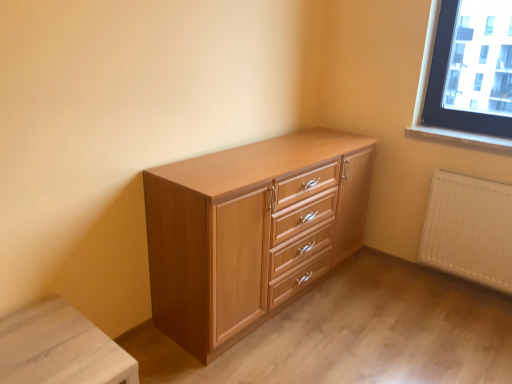
Question: Is smooth wood window sill at upper right next to light brown wood chest of drawers at center and touching it?

Choices:
 (A) no
 (B) yes

Answer: (A)

Question: From a real-world perspective, is smooth wood window sill at upper right physically below light brown wood chest of drawers at center?

Choices:
 (A) no
 (B) yes

Answer: (A)

Question: Considering the relative positions of smooth wood window sill at upper right and light brown wood chest of drawers at center in the image provided, is smooth wood window sill at upper right behind light brown wood chest of drawers at center?

Choices:
 (A) yes
 (B) no

Answer: (A)

Question: Can you confirm if smooth wood window sill at upper right is bigger than light brown wood chest of drawers at center?

Choices:
 (A) no
 (B) yes

Answer: (A)

Question: Is smooth wood window sill at upper right to the right of light brown wood chest of drawers at center from the viewer's perspective?

Choices:
 (A) no
 (B) yes

Answer: (B)

Question: In terms of width, does light wood changing table at lower left look wider or thinner when compared to white matte radiator at lower right?

Choices:
 (A) thin
 (B) wide

Answer: (B)

Question: From the image's perspective, is light wood changing table at lower left above or below white matte radiator at lower right?

Choices:
 (A) below
 (B) above

Answer: (A)

Question: Considering their positions, is light wood changing table at lower left located in front of or behind white matte radiator at lower right?

Choices:
 (A) front
 (B) behind

Answer: (A)

Question: Visually, is light wood changing table at lower left positioned to the left or to the right of white matte radiator at lower right?

Choices:
 (A) right
 (B) left

Answer: (B)

Question: Is smooth wood window sill at upper right in front of or behind white matte radiator at lower right in the image?

Choices:
 (A) front
 (B) behind

Answer: (B)

Question: Does point (467, 137) appear closer or farther from the camera than point (490, 205)?

Choices:
 (A) closer
 (B) farther

Answer: (B)

Question: Visually, is smooth wood window sill at upper right positioned to the left or to the right of white matte radiator at lower right?

Choices:
 (A) right
 (B) left

Answer: (B)

Question: Considering the positions of smooth wood window sill at upper right and white matte radiator at lower right in the image, is smooth wood window sill at upper right wider or thinner than white matte radiator at lower right?

Choices:
 (A) wide
 (B) thin

Answer: (A)

Question: Is light brown wood chest of drawers at center to the left or to the right of smooth wood window sill at upper right in the image?

Choices:
 (A) left
 (B) right

Answer: (A)

Question: Considering the positions of light brown wood chest of drawers at center and smooth wood window sill at upper right in the image, is light brown wood chest of drawers at center bigger or smaller than smooth wood window sill at upper right?

Choices:
 (A) small
 (B) big

Answer: (B)